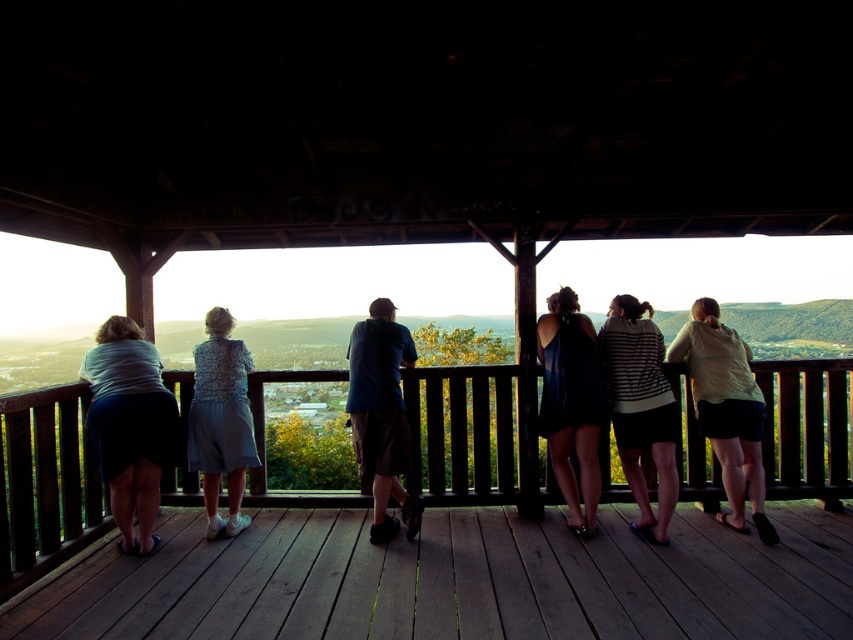
Question: Which of the following is the farthest from the observer?

Choices:
 (A) matte blue skirt at left
 (B) wooden porch at center
 (C) light blue fabric dress at left
 (D) striped hoodie at center

Answer: (C)

Question: Where is light yellow shirt at center located in relation to striped hoodie at center in the image?

Choices:
 (A) right
 (B) left

Answer: (A)

Question: Is wooden deck at center positioned before blue cotton shirt at center?

Choices:
 (A) yes
 (B) no

Answer: (A)

Question: Which point is closer to the camera taking this photo?

Choices:
 (A) (576, 432)
 (B) (131, 330)

Answer: (B)

Question: Estimate the real-world distances between objects in this image. Which object is closer to the light blue fabric dress at left?

Choices:
 (A) blue cotton shirt at center
 (B) striped hoodie at center
 (C) wooden deck at center
 (D) wooden porch at center

Answer: (D)

Question: Is light yellow shirt at center wider than blue cotton shirt at center?

Choices:
 (A) yes
 (B) no

Answer: (A)